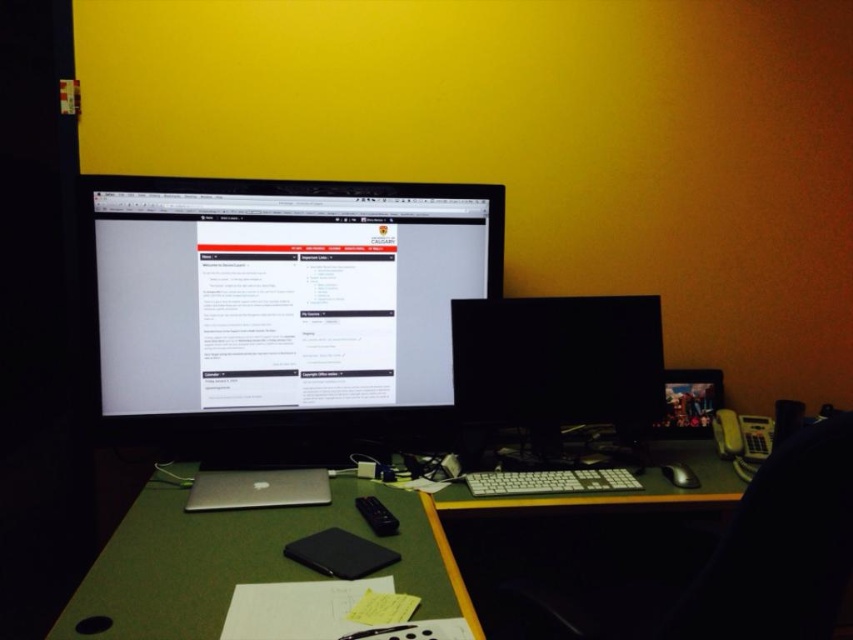
The width and height of the screenshot is (853, 640). What do you see at coordinates (350, 531) in the screenshot?
I see `green felt table at lower center` at bounding box center [350, 531].

Between point (115, 552) and point (779, 579), which one is positioned in front?

Point (779, 579)

Identify the location of green felt table at lower center. (350, 531).

Does black glossy monitor at center have a lesser width compared to white plastic keyboard at center?

No.

Which is in front, point (560, 410) or point (473, 483)?

Point (473, 483) is in front.

Does point (576, 396) lie behind point (577, 472)?

That is True.

Identify the location of black glossy monitor at center. (554, 368).

Can you confirm if matte black monitor at center is shorter than black plastic chair at right?

Yes, matte black monitor at center is shorter than black plastic chair at right.

Which is above, matte black monitor at center or black plastic chair at right?

matte black monitor at center is higher up.

What do you see at coordinates (280, 305) in the screenshot? This screenshot has height=640, width=853. I see `matte black monitor at center` at bounding box center [280, 305].

You are a GUI agent. You are given a task and a screenshot of the screen. Output one action in this format:
    pyautogui.click(x=<x>, y=<y>)
    Task: Click on the matte black monitor at center
    The width and height of the screenshot is (853, 640).
    Given the screenshot: What is the action you would take?
    pyautogui.click(x=280, y=305)